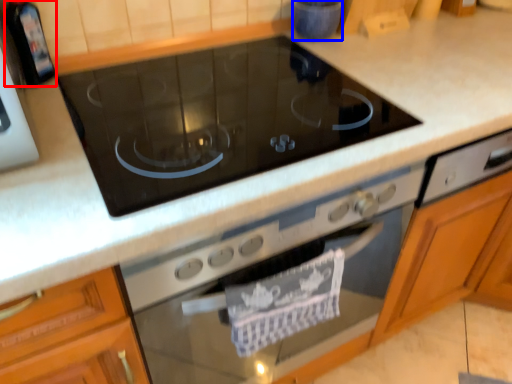
Question: Which object appears farthest to the camera in this image, appliance (highlighted by a red box) or appliance (highlighted by a blue box)?

Choices:
 (A) appliance
 (B) appliance

Answer: (B)